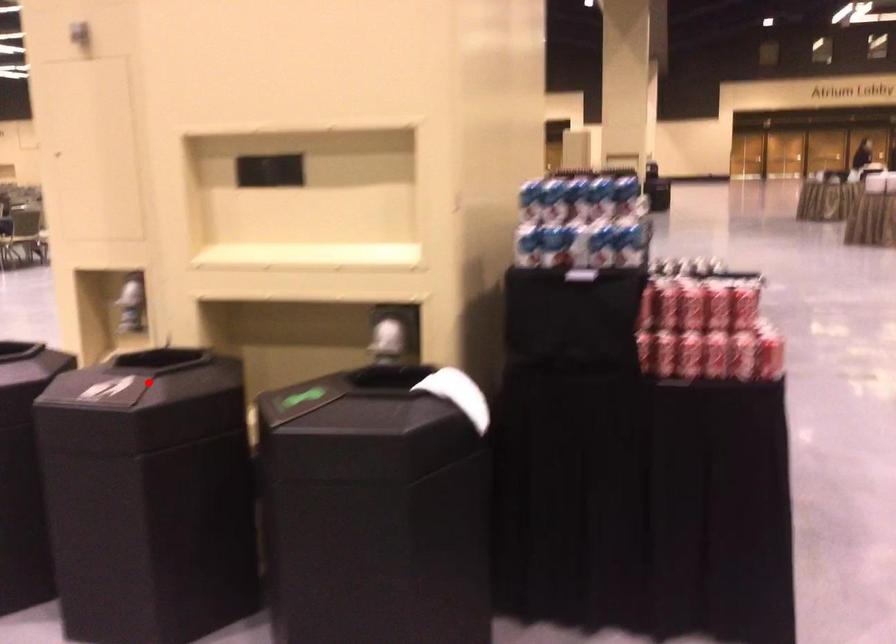
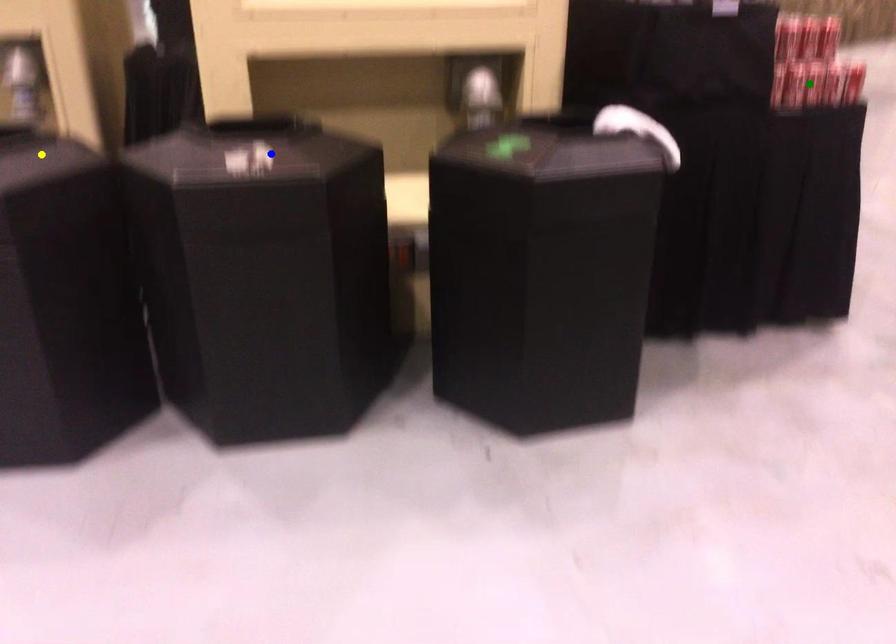
Question: I am providing you with two images of the same scene from different viewpoints. A red point is marked on the first image. You are given multiple points on the second image. In image 2, which mark is for the same physical point as the one in image 1?

Choices:
 (A) yellow point
 (B) green point
 (C) blue point

Answer: (C)